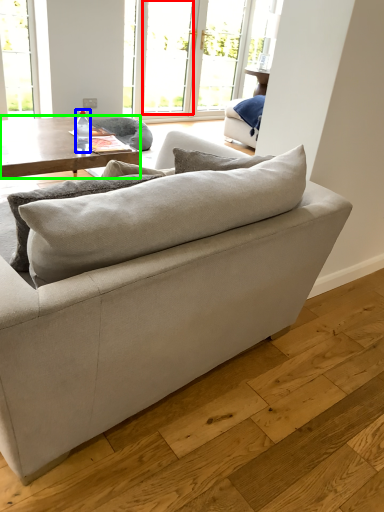
Question: Based on their relative distances, which object is nearer to window (highlighted by a red box)? Choose from bottle (highlighted by a blue box) and coffee table (highlighted by a green box).

Choices:
 (A) bottle
 (B) coffee table

Answer: (B)